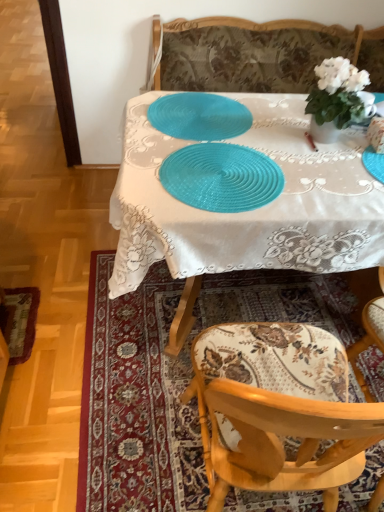
Where is `empty space that is ontop of wooden chair at lower right`? This screenshot has height=512, width=384. empty space that is ontop of wooden chair at lower right is located at coordinates (200, 311).